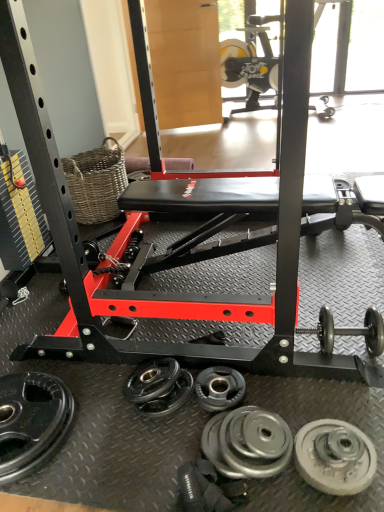
Find the location of a particular element. silver metallic weight plate at lower center, which ranks as the third wheel in left-to-right order is located at coordinates (247, 443).

Measure the distance between point (75,205) and camera.

Point (75,205) and camera are 7.70 feet apart from each other.

What do you see at coordinates (31, 421) in the screenshot?
I see `black rubber weight plate at lower left, the first wheel positioned from the left` at bounding box center [31, 421].

Where is `black rubber weight plate at center, the 2th wheel in the left-to-right sequence`? The width and height of the screenshot is (384, 512). black rubber weight plate at center, the 2th wheel in the left-to-right sequence is located at coordinates (219, 388).

In the scene shown: Considering the sizes of black rubber weight plate at center, the 2th wheel in the left-to-right sequence, and silver metallic weight plate at lower center, the second wheel in the right-to-left sequence, in the image, is black rubber weight plate at center, the 2th wheel in the left-to-right sequence, wider or thinner than silver metallic weight plate at lower center, the second wheel in the right-to-left sequence,?

Clearly, black rubber weight plate at center, the 2th wheel in the left-to-right sequence, has less width compared to silver metallic weight plate at lower center, the second wheel in the right-to-left sequence.

Is there a large distance between black rubber weight plate at center, the third wheel viewed from the right, and silver metallic weight plate at lower center, the second wheel in the right-to-left sequence?

That's not correct — black rubber weight plate at center, the third wheel viewed from the right, is a little close to silver metallic weight plate at lower center, the second wheel in the right-to-left sequence.

Do you think black rubber weight plate at center, the third wheel viewed from the right, is within silver metallic weight plate at lower center, the second wheel in the right-to-left sequence, or outside of it?

black rubber weight plate at center, the third wheel viewed from the right, lies outside silver metallic weight plate at lower center, the second wheel in the right-to-left sequence.

Which is farther, (203, 401) or (252, 432)?

The point (203, 401) is behind.

Identify the location of wheel that is the 1st object to the left of the silver metallic weight plate at lower right, marked as the fourth wheel in a left-to-right arrangement, starting at the anchor. This screenshot has width=384, height=512. (247, 443).

From the image's perspective, is silver metallic weight plate at lower center, which ranks as the third wheel in left-to-right order, located above or below silver metallic weight plate at lower right, marked as the fourth wheel in a left-to-right arrangement?

From the image's perspective, silver metallic weight plate at lower center, which ranks as the third wheel in left-to-right order, appears above silver metallic weight plate at lower right, marked as the fourth wheel in a left-to-right arrangement.

Is silver metallic weight plate at lower center, the second wheel in the right-to-left sequence, situated inside silver metallic weight plate at lower right, arranged as the 1th wheel when viewed from the right, or outside?

The correct answer is: outside.

Consider the image. Can you confirm if silver metallic weight plate at lower center, which ranks as the third wheel in left-to-right order, is positioned to the left of silver metallic weight plate at lower right, marked as the fourth wheel in a left-to-right arrangement?

Correct, you'll find silver metallic weight plate at lower center, which ranks as the third wheel in left-to-right order, to the left of silver metallic weight plate at lower right, marked as the fourth wheel in a left-to-right arrangement.

Considering the sizes of objects silver metallic weight plate at lower right, marked as the fourth wheel in a left-to-right arrangement, and polished silver dumbbell at lower right in the image provided, who is thinner, silver metallic weight plate at lower right, marked as the fourth wheel in a left-to-right arrangement, or polished silver dumbbell at lower right?

silver metallic weight plate at lower right, marked as the fourth wheel in a left-to-right arrangement, is thinner.

This screenshot has width=384, height=512. In order to click on dumbbell above the silver metallic weight plate at lower right, marked as the fourth wheel in a left-to-right arrangement (from the image's perspective) in this screenshot , I will do `click(349, 331)`.

Is point (307, 473) less distant than point (333, 325)?

Yes, it is in front of point (333, 325).

How different are the orientations of silver metallic weight plate at lower right, marked as the fourth wheel in a left-to-right arrangement, and polished silver dumbbell at lower right in degrees?

The facing directions of silver metallic weight plate at lower right, marked as the fourth wheel in a left-to-right arrangement, and polished silver dumbbell at lower right are 3.8 degrees apart.

At what (x,y) coordinates should I click in order to perform the action: click on wheel below the silver metallic weight plate at lower center, which ranks as the third wheel in left-to-right order (from the image's perspective). Please return your answer as a coordinate pair (x, y). The height and width of the screenshot is (512, 384). Looking at the image, I should click on (335, 457).

Is silver metallic weight plate at lower right, marked as the fourth wheel in a left-to-right arrangement, not near silver metallic weight plate at lower center, the second wheel in the right-to-left sequence?

silver metallic weight plate at lower right, marked as the fourth wheel in a left-to-right arrangement, is near silver metallic weight plate at lower center, the second wheel in the right-to-left sequence, not far away.

Considering the positions of points (301, 471) and (247, 465), is point (301, 471) closer to camera compared to point (247, 465)?

No.

How different are the orientations of silver metallic weight plate at lower right, arranged as the 1th wheel when viewed from the right, and silver metallic weight plate at lower center, the second wheel in the right-to-left sequence, in degrees?

The angle between the facing direction of silver metallic weight plate at lower right, arranged as the 1th wheel when viewed from the right, and the facing direction of silver metallic weight plate at lower center, the second wheel in the right-to-left sequence, is 93.7 degrees.

Can you confirm if silver metallic weight plate at lower center, which ranks as the third wheel in left-to-right order, is thinner than woven brown basket at upper left?

Yes.

Does silver metallic weight plate at lower center, the second wheel in the right-to-left sequence, appear on the right side of woven brown basket at upper left?

Yes, silver metallic weight plate at lower center, the second wheel in the right-to-left sequence, is to the right of woven brown basket at upper left.

Is silver metallic weight plate at lower center, which ranks as the third wheel in left-to-right order, located outside woven brown basket at upper left?

Indeed, silver metallic weight plate at lower center, which ranks as the third wheel in left-to-right order, is completely outside woven brown basket at upper left.

In the scene shown: How different are the orientations of silver metallic weight plate at lower center, the second wheel in the right-to-left sequence, and woven brown basket at upper left in degrees?

There is a 96.7-degree angle between the facing directions of silver metallic weight plate at lower center, the second wheel in the right-to-left sequence, and woven brown basket at upper left.

Does black rubber weight plate at center, the third wheel viewed from the right, appear on the right side of woven brown basket at upper left?

Yes, black rubber weight plate at center, the third wheel viewed from the right, is to the right of woven brown basket at upper left.

From a real-world perspective, does black rubber weight plate at center, the 2th wheel in the left-to-right sequence, stand above woven brown basket at upper left?

No, from a real-world perspective, black rubber weight plate at center, the 2th wheel in the left-to-right sequence, is not on top of woven brown basket at upper left.

Who is smaller, black rubber weight plate at center, the third wheel viewed from the right, or woven brown basket at upper left?

With smaller size is black rubber weight plate at center, the third wheel viewed from the right.

Between silver metallic weight plate at lower right, arranged as the 1th wheel when viewed from the right, and woven brown basket at upper left, which one has less height?

silver metallic weight plate at lower right, arranged as the 1th wheel when viewed from the right, is shorter.

Is silver metallic weight plate at lower right, marked as the fourth wheel in a left-to-right arrangement, further to camera compared to woven brown basket at upper left?

No, the depth of silver metallic weight plate at lower right, marked as the fourth wheel in a left-to-right arrangement, is less than that of woven brown basket at upper left.

You are a GUI agent. You are given a task and a screenshot of the screen. Output one action in this format:
    pyautogui.click(x=<x>, y=<y>)
    Task: Click on the basket located above the silver metallic weight plate at lower right, arranged as the 1th wheel when viewed from the right (from the image's perspective)
    Image resolution: width=384 pixels, height=512 pixels.
    Given the screenshot: What is the action you would take?
    pyautogui.click(x=96, y=182)

The image size is (384, 512). I want to click on the 2nd wheel below the black rubber weight plate at center, the third wheel viewed from the right (from the image's perspective), so click(247, 443).

From the image's perspective, count 1st wheels upward from the silver metallic weight plate at lower right, arranged as the 1th wheel when viewed from the right, and point to it. Please provide its 2D coordinates.

[(247, 443)]

Considering their positions, is silver metallic weight plate at lower right, arranged as the 1th wheel when viewed from the right, positioned further to black rubber weight plate at lower left, the 4th wheel from the right, than black rubber weight plate at center, the 2th wheel in the left-to-right sequence?

silver metallic weight plate at lower right, arranged as the 1th wheel when viewed from the right, is positioned further to the anchor black rubber weight plate at lower left, the 4th wheel from the right.

Considering their positions, is black rubber weight plate at lower left, the first wheel positioned from the left, positioned further to silver metallic weight plate at lower right, marked as the fourth wheel in a left-to-right arrangement, than silver metallic weight plate at lower center, the second wheel in the right-to-left sequence?

The object further to silver metallic weight plate at lower right, marked as the fourth wheel in a left-to-right arrangement, is black rubber weight plate at lower left, the first wheel positioned from the left.

Considering their positions, is black rubber weight plate at lower left, the first wheel positioned from the left, positioned further to silver metallic weight plate at lower right, marked as the fourth wheel in a left-to-right arrangement, than black rubber weight plate at center, the 2th wheel in the left-to-right sequence?

Among the two, black rubber weight plate at lower left, the first wheel positioned from the left, is located further to silver metallic weight plate at lower right, marked as the fourth wheel in a left-to-right arrangement.

Considering their positions, is silver metallic weight plate at lower center, which ranks as the third wheel in left-to-right order, positioned further to black rubber weight plate at lower left, the first wheel positioned from the left, than polished silver dumbbell at lower right?

polished silver dumbbell at lower right is further to black rubber weight plate at lower left, the first wheel positioned from the left.

Estimate the real-world distances between objects in this image. Which object is further from silver metallic weight plate at lower center, which ranks as the third wheel in left-to-right order, black rubber weight plate at center, the third wheel viewed from the right, or woven brown basket at upper left?

woven brown basket at upper left lies further to silver metallic weight plate at lower center, which ranks as the third wheel in left-to-right order, than the other object.

Based on their spatial positions, is black rubber weight plate at center, the 2th wheel in the left-to-right sequence, or silver metallic weight plate at lower right, arranged as the 1th wheel when viewed from the right, further from silver metallic weight plate at lower center, which ranks as the third wheel in left-to-right order?

black rubber weight plate at center, the 2th wheel in the left-to-right sequence, is further to silver metallic weight plate at lower center, which ranks as the third wheel in left-to-right order.

Which object lies further to the anchor point silver metallic weight plate at lower right, arranged as the 1th wheel when viewed from the right, silver metallic weight plate at lower center, which ranks as the third wheel in left-to-right order, or black rubber weight plate at lower left, the first wheel positioned from the left?

black rubber weight plate at lower left, the first wheel positioned from the left.

From the picture: Based on their spatial positions, is polished silver dumbbell at lower right or woven brown basket at upper left closer to black rubber weight plate at lower left, the 4th wheel from the right?

polished silver dumbbell at lower right is closer to black rubber weight plate at lower left, the 4th wheel from the right.

This screenshot has height=512, width=384. In order to click on dumbbell between silver metallic weight plate at lower center, which ranks as the third wheel in left-to-right order, and woven brown basket at upper left from front to back in this screenshot , I will do `click(349, 331)`.

The height and width of the screenshot is (512, 384). Identify the location of wheel between black rubber weight plate at lower left, the first wheel positioned from the left, and silver metallic weight plate at lower center, the second wheel in the right-to-left sequence. (219, 388).

Identify the location of wheel between silver metallic weight plate at lower center, which ranks as the third wheel in left-to-right order, and polished silver dumbbell at lower right from left to right. (335, 457).

Find the location of `wheel between black rubber weight plate at center, the third wheel viewed from the right, and silver metallic weight plate at lower right, marked as the fourth wheel in a left-to-right arrangement`. wheel between black rubber weight plate at center, the third wheel viewed from the right, and silver metallic weight plate at lower right, marked as the fourth wheel in a left-to-right arrangement is located at coordinates (247, 443).